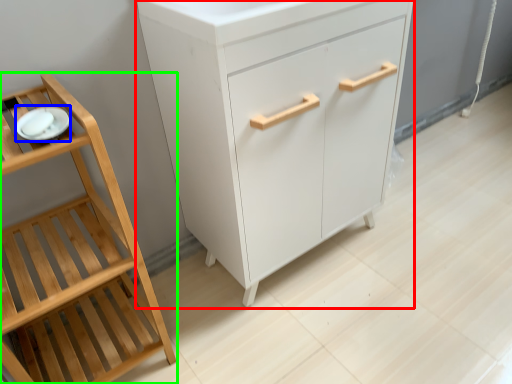
Question: Based on their relative distances, which object is nearer to chest of drawers (highlighted by a red box)? Choose from tableware (highlighted by a blue box) and furniture (highlighted by a green box).

Choices:
 (A) tableware
 (B) furniture

Answer: (B)